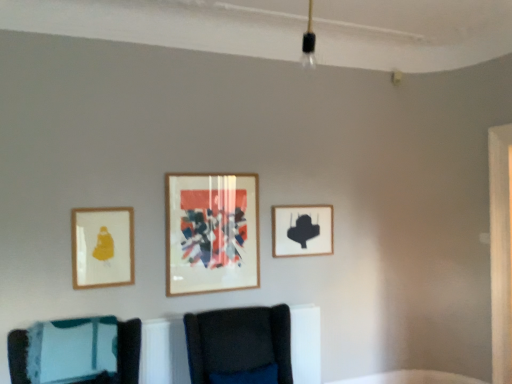
Question: Is teal fabric cushion at lower left, arranged as the 1th furniture when viewed from the left, wider than velvet dark blue chair at center, which appears as the second furniture when viewed from the left?

Choices:
 (A) no
 (B) yes

Answer: (A)

Question: From a real-world perspective, is teal fabric cushion at lower left, arranged as the 1th furniture when viewed from the left, physically above velvet dark blue chair at center, arranged as the 1th furniture when viewed from the right?

Choices:
 (A) no
 (B) yes

Answer: (B)

Question: Is teal fabric cushion at lower left, arranged as the 1th furniture when viewed from the left, oriented towards velvet dark blue chair at center, which appears as the second furniture when viewed from the left?

Choices:
 (A) no
 (B) yes

Answer: (A)

Question: Can velvet dark blue chair at center, arranged as the 1th furniture when viewed from the right, be found inside teal fabric cushion at lower left, which is counted as the second furniture, starting from the right?

Choices:
 (A) no
 (B) yes

Answer: (A)

Question: Would you say teal fabric cushion at lower left, which is counted as the second furniture, starting from the right, is a long distance from velvet dark blue chair at center, which appears as the second furniture when viewed from the left?

Choices:
 (A) yes
 (B) no

Answer: (B)

Question: Is teal fabric cushion at lower left, which is counted as the second furniture, starting from the right, shorter than velvet dark blue chair at center, arranged as the 1th furniture when viewed from the right?

Choices:
 (A) yes
 (B) no

Answer: (A)

Question: Is the depth of wooden-framed artwork at center, arranged as the 2th picture frame when viewed from the left, greater than that of velvet dark blue chair at center, which appears as the second furniture when viewed from the left?

Choices:
 (A) no
 (B) yes

Answer: (B)

Question: Considering the relative sizes of wooden-framed artwork at center, marked as the second picture frame in a front-to-back arrangement, and velvet dark blue chair at center, arranged as the 1th furniture when viewed from the right, in the image provided, is wooden-framed artwork at center, marked as the second picture frame in a front-to-back arrangement, smaller than velvet dark blue chair at center, arranged as the 1th furniture when viewed from the right,?

Choices:
 (A) yes
 (B) no

Answer: (A)

Question: Is wooden-framed artwork at center, arranged as the 2th picture frame when viewed from the left, thinner than velvet dark blue chair at center, which appears as the second furniture when viewed from the left?

Choices:
 (A) yes
 (B) no

Answer: (A)

Question: Is velvet dark blue chair at center, arranged as the 1th furniture when viewed from the right, a part of wooden-framed artwork at center, positioned as the second picture frame in back-to-front order?

Choices:
 (A) yes
 (B) no

Answer: (B)

Question: Could you tell me if wooden-framed artwork at center, marked as the second picture frame in a front-to-back arrangement, is turned towards velvet dark blue chair at center, which appears as the second furniture when viewed from the left?

Choices:
 (A) no
 (B) yes

Answer: (A)

Question: From a real-world perspective, is wooden-framed artwork at center, marked as the second picture frame in a front-to-back arrangement, located higher than velvet dark blue chair at center, arranged as the 1th furniture when viewed from the right?

Choices:
 (A) yes
 (B) no

Answer: (A)

Question: From a real-world perspective, is matte gold picture frame at left, the 3th picture frame in the back-to-front sequence, below velvet dark blue chair at center, which appears as the second furniture when viewed from the left?

Choices:
 (A) yes
 (B) no

Answer: (B)